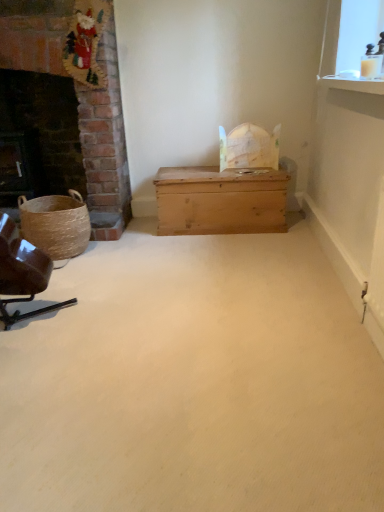
Question: Is the depth of light brown wooden chest at center greater than that of brown leather chair at left?

Choices:
 (A) yes
 (B) no

Answer: (A)

Question: Considering the relative sizes of light brown wooden chest at center and brown leather chair at left in the image provided, is light brown wooden chest at center smaller than brown leather chair at left?

Choices:
 (A) no
 (B) yes

Answer: (A)

Question: From the image's perspective, is light brown wooden chest at center on brown leather chair at left?

Choices:
 (A) no
 (B) yes

Answer: (B)

Question: Does light brown wooden chest at center appear on the left side of brown leather chair at left?

Choices:
 (A) yes
 (B) no

Answer: (B)

Question: Is light brown wooden chest at center oriented away from brown leather chair at left?

Choices:
 (A) yes
 (B) no

Answer: (B)

Question: Is light brown wooden chest at center thinner than brown leather chair at left?

Choices:
 (A) no
 (B) yes

Answer: (A)

Question: Is light brown wooden chest at center next to wooden trunk at center?

Choices:
 (A) yes
 (B) no

Answer: (B)

Question: Considering the relative sizes of light brown wooden chest at center and wooden trunk at center in the image provided, is light brown wooden chest at center taller than wooden trunk at center?

Choices:
 (A) yes
 (B) no

Answer: (A)

Question: Is there a large distance between light brown wooden chest at center and wooden trunk at center?

Choices:
 (A) yes
 (B) no

Answer: (A)

Question: Can you confirm if light brown wooden chest at center is shorter than wooden trunk at center?

Choices:
 (A) yes
 (B) no

Answer: (B)

Question: Is light brown wooden chest at center behind wooden trunk at center?

Choices:
 (A) no
 (B) yes

Answer: (B)

Question: Is light brown wooden chest at center thinner than wooden trunk at center?

Choices:
 (A) yes
 (B) no

Answer: (A)

Question: Is dark brick fireplace at left closer to camera compared to brown leather chair at left?

Choices:
 (A) no
 (B) yes

Answer: (A)